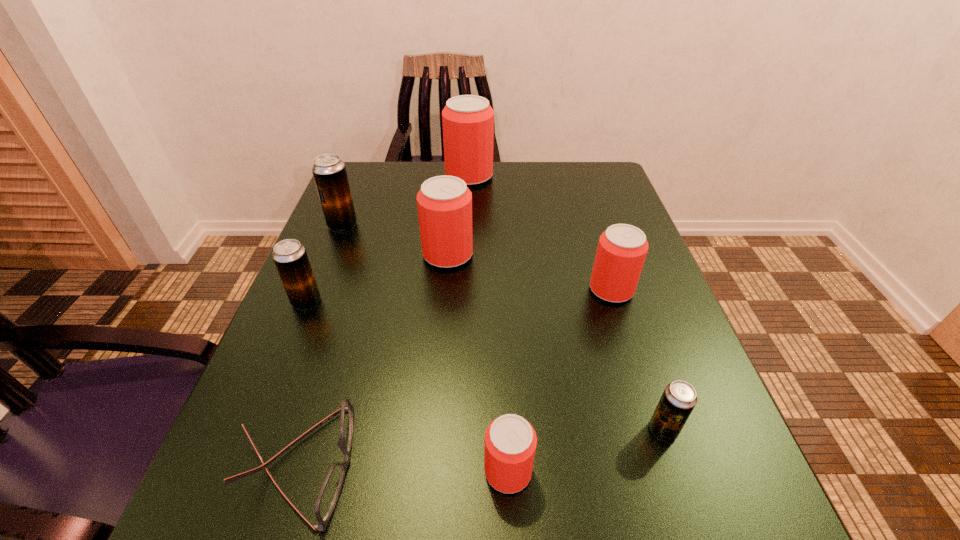
At what (x,y) coordinates should I click in order to perform the action: click on the smallest black beer can. Please return your answer as a coordinate pair (x, y). This screenshot has height=540, width=960. Looking at the image, I should click on (679, 398).

The height and width of the screenshot is (540, 960). I want to click on the smallest red beer can, so click(510, 441).

The height and width of the screenshot is (540, 960). Identify the location of the nearest beer can. (510, 441).

This screenshot has width=960, height=540. What are the coordinates of `the shortest object` in the screenshot? It's located at (329, 492).

Find the location of a particular element. This screenshot has height=540, width=960. free point located on the left of the tallest object is located at coordinates (404, 176).

I want to click on free spot located 0.170m on the front of the farthest black beer can, so click(319, 285).

At what (x,y) coordinates should I click in order to perform the action: click on free space located on the front of the third farthest object. Please return your answer as a coordinate pair (x, y). This screenshot has height=540, width=960. Looking at the image, I should click on (443, 314).

Identify the location of free space located 0.350m on the back of the rightmost red beer can. (578, 186).

Where is `vacant region located on the right of the second farthest black beer can`? vacant region located on the right of the second farthest black beer can is located at coordinates (352, 301).

Locate an element on the screen. free space located on the left of the rightmost black beer can is located at coordinates (573, 430).